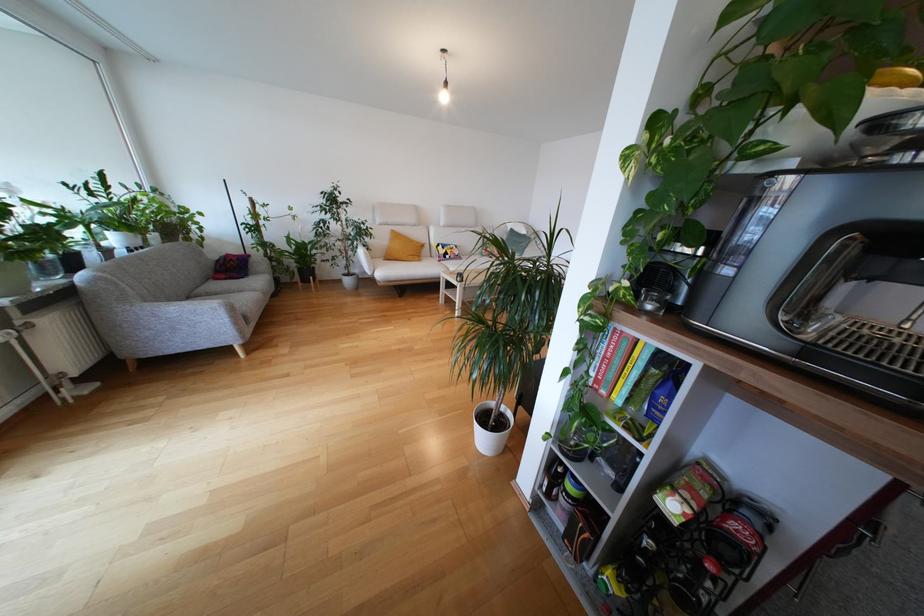
What are the coordinates of `white sofa sitting surface` in the screenshot? It's located at (172, 302).